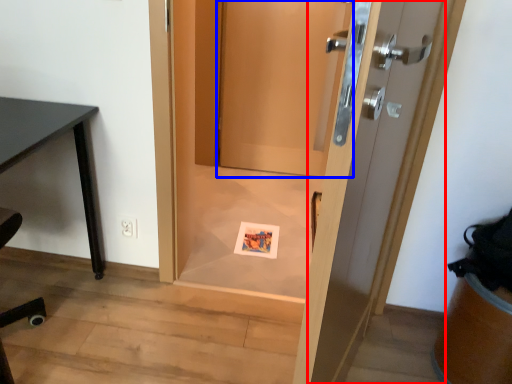
Question: Which object is closer to the camera taking this photo, door (highlighted by a red box) or door (highlighted by a blue box)?

Choices:
 (A) door
 (B) door

Answer: (A)